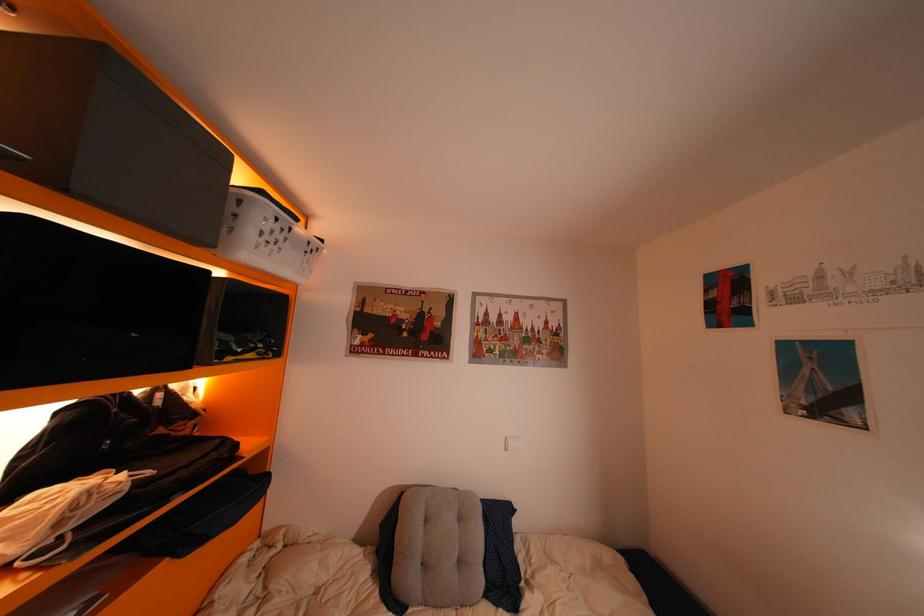
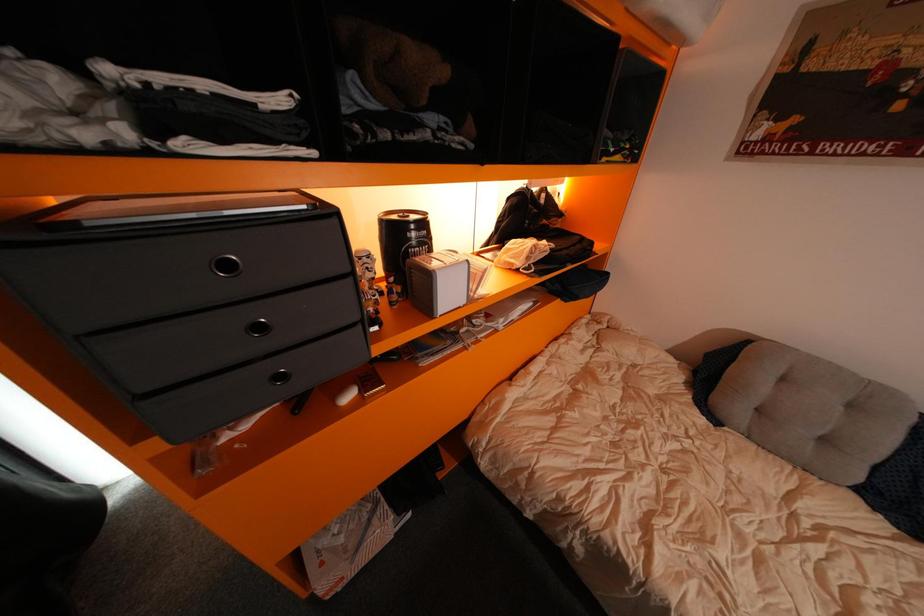
The images are taken continuously from a first-person perspective. In which direction is your viewpoint rotating?

The camera rotated toward left-down.